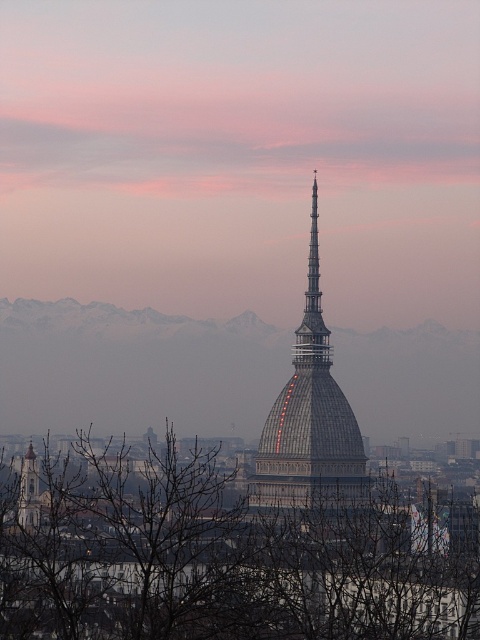
Is point (11, 547) positioned in front of point (320, 474)?

No, it is not.

Identify the location of bare branches at center. (219, 561).

Is metallic dome at center to the left of gray stone tower at center from the viewer's perspective?

Indeed, metallic dome at center is positioned on the left side of gray stone tower at center.

Can you confirm if metallic dome at center is positioned to the right of gray stone tower at center?

No, metallic dome at center is not to the right of gray stone tower at center.

Is point (402, 353) positioned after point (314, 339)?

Yes, point (402, 353) is farther from viewer.

At what (x,y) coordinates should I click in order to perform the action: click on metallic dome at center. Please return your answer as a coordinate pair (x, y). The width and height of the screenshot is (480, 640). Looking at the image, I should click on (135, 369).

Is gray stone tower at center wider than brick tower at left?

Yes.

Based on the photo, does gray stone tower at center appear on the right side of brick tower at left?

Correct, you'll find gray stone tower at center to the right of brick tower at left.

At what (x,y) coordinates should I click in order to perform the action: click on gray stone tower at center. Please return your answer as a coordinate pair (x, y). The height and width of the screenshot is (640, 480). Looking at the image, I should click on (311, 429).